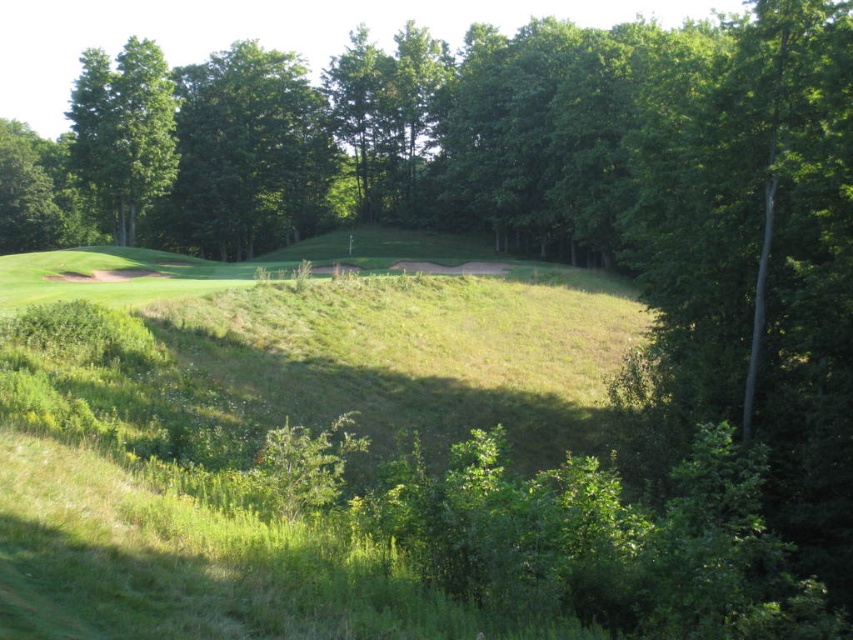
Question: Is green leafy tree at upper center positioned in front of green leafy tree at upper left?

Choices:
 (A) no
 (B) yes

Answer: (A)

Question: Can you confirm if green leafy tree at upper center is positioned below green leafy tree at upper left?

Choices:
 (A) no
 (B) yes

Answer: (B)

Question: Which object appears closest to the camera in this image?

Choices:
 (A) green leafy tree at upper left
 (B) green leafy tree at upper center

Answer: (A)

Question: Which of the following is the farthest from the observer?

Choices:
 (A) green leafy tree at upper center
 (B) green leafy tree at upper left

Answer: (A)

Question: Does green leafy tree at upper center have a greater width compared to green leafy tree at upper left?

Choices:
 (A) no
 (B) yes

Answer: (A)